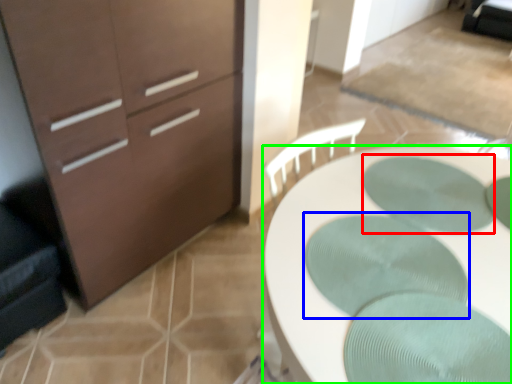
Question: Which object is the closest to the oval (highlighted by a red box)? Choose among these: oval (highlighted by a blue box) or desk (highlighted by a green box).

Choices:
 (A) oval
 (B) desk

Answer: (B)